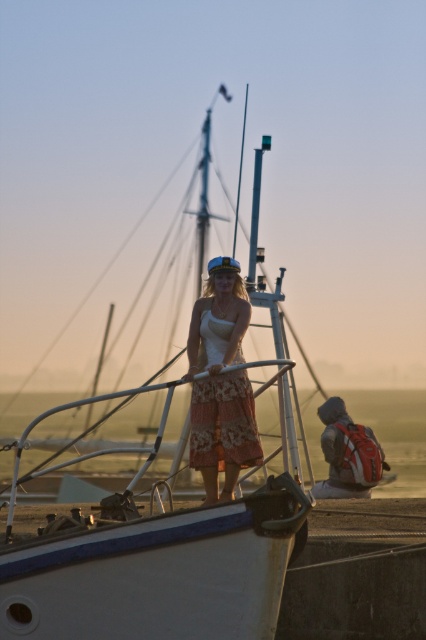
Based on the coordinates provided, which object is located at point (150,560) in the scene?

The point (150,560) indicates the location of the white matte boat at center.

You are a photographer standing on the deck of the sailboat. You want to take a photo of the matte white dress at center and the red backpack at lower right. How far apart are these two items from each other?

The matte white dress at center is 22.65 feet away from the red backpack at lower right.